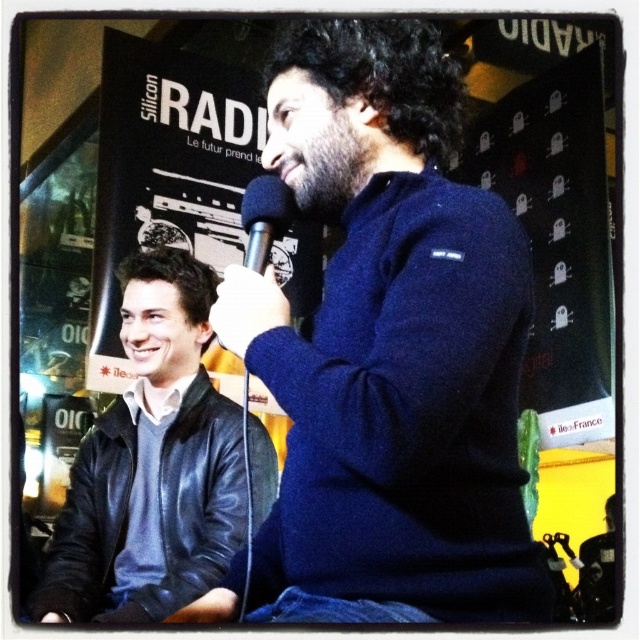
You are organizing a photo shoot and need to arrange two items from the scene for a closeup. The items are the dark blue sweater at center and the leather jacket at left. Given their sizes, which item should you place closer to the camera to ensure both fit in the frame without cropping?

The dark blue sweater at center has a lesser width compared to the leather jacket at left, so you should place the leather jacket at left closer to the camera. This way, its larger size will occupy more space in the frame, allowing the smaller dark blue sweater at center to fit alongside without needing to crop either.

You are attending a conference and notice the dark blue sweater at center and the black metallic microphone at center. Based on their positions, which object is closer to the front of the stage?

The dark blue sweater at center is located below the black metallic microphone at center, meaning the dark blue sweater at center is closer to the front of the stage since it is positioned lower in the image.

You are attending a tech conference and notice two points in the image. The first point is at coordinates point (392, 188) and the second is at point (186, 419). Which point is closer to you?

Point (392, 188) is closer to the viewer than point (186, 419).